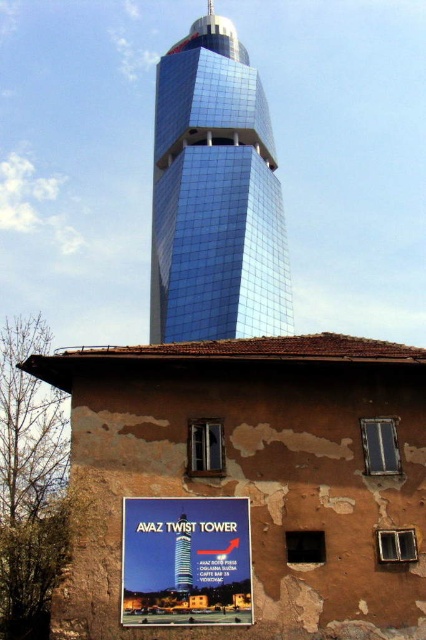
Question: Does shiny glass tower at center have a smaller size compared to matte plastic sign at center?

Choices:
 (A) yes
 (B) no

Answer: (B)

Question: Can you confirm if shiny glass tower at center is positioned above matte plastic sign at center?

Choices:
 (A) yes
 (B) no

Answer: (A)

Question: Which of the following is the closest to the observer?

Choices:
 (A) shiny glass tower at center
 (B) matte plastic sign at center

Answer: (B)

Question: From the image, what is the correct spatial relationship of shiny glass tower at center in relation to matte plastic sign at center?

Choices:
 (A) right
 (B) left

Answer: (B)